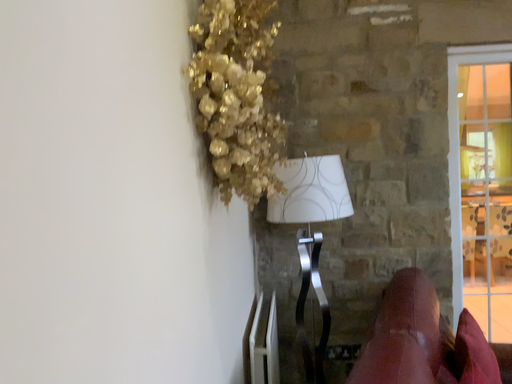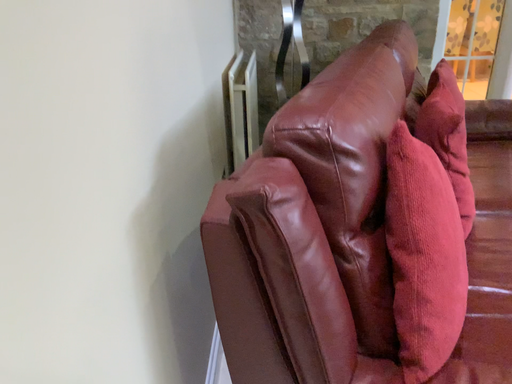
Question: Which way did the camera rotate in the video?

Choices:
 (A) rotated downward
 (B) rotated upward

Answer: (A)